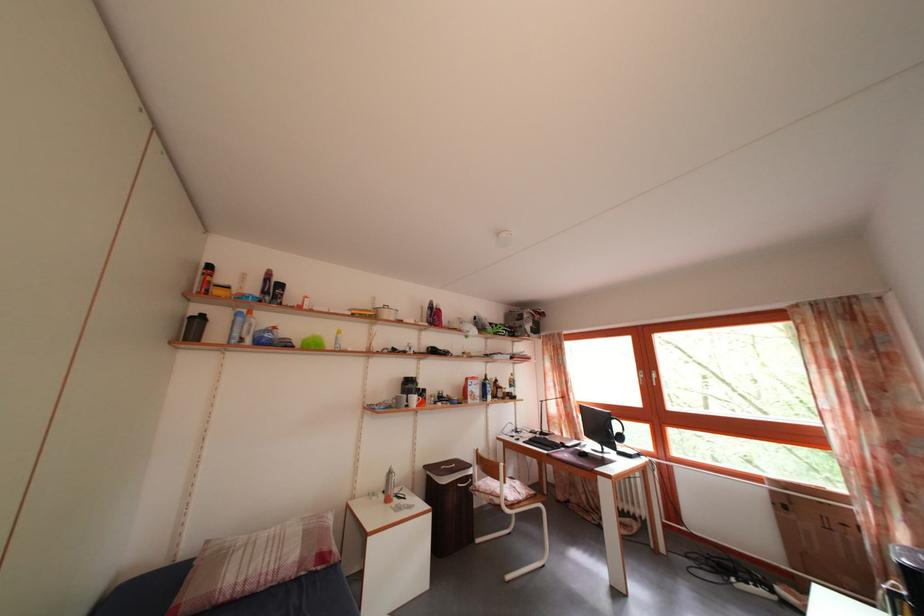
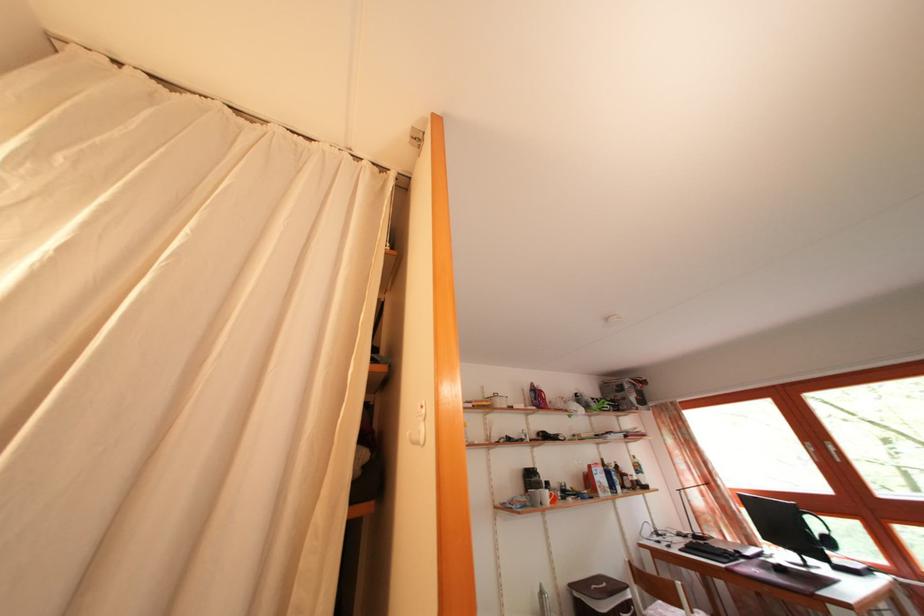
Where in the second image is the point corresponding to pixel 444 475 from the first image?

(592, 594)